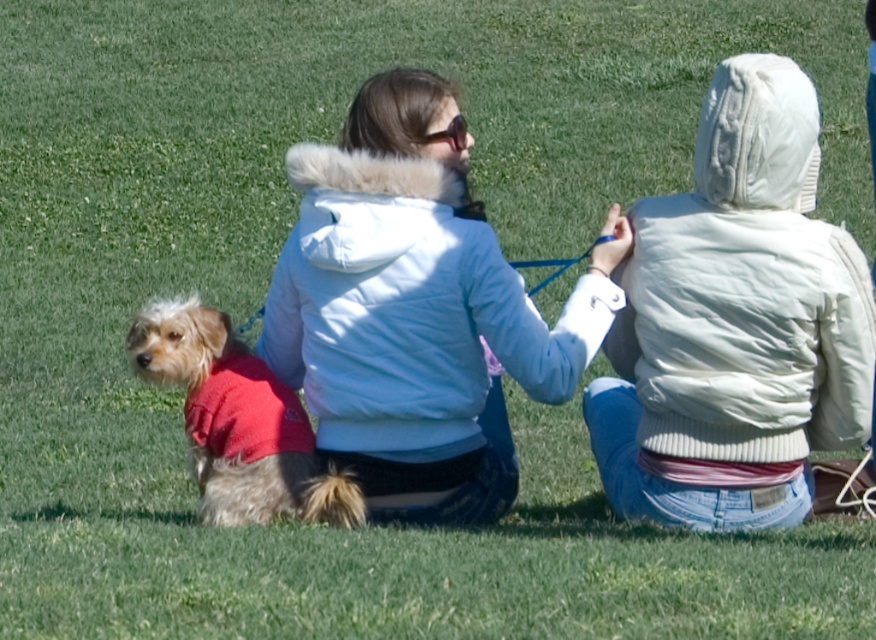
Question: Which point is closer to the camera?

Choices:
 (A) (239, 492)
 (B) (281, 280)
 (C) (454, 129)
 (D) (782, 483)

Answer: (D)

Question: Estimate the real-world distances between objects in this image. Which object is farther from the white fuzzy jacket at upper right?

Choices:
 (A) fuzzy red sweater at lower left
 (B) clear plastic goggles at center

Answer: (A)

Question: Can you confirm if fuzzy red sweater at lower left is positioned to the left of clear plastic goggles at center?

Choices:
 (A) no
 (B) yes

Answer: (B)

Question: Does light blue puffy jacket at center come in front of clear plastic goggles at center?

Choices:
 (A) yes
 (B) no

Answer: (A)

Question: Is light blue puffy jacket at center further to the viewer compared to fuzzy red sweater at lower left?

Choices:
 (A) yes
 (B) no

Answer: (B)

Question: Which point appears closest to the camera in this image?

Choices:
 (A) (643, 378)
 (B) (126, 342)
 (C) (380, 240)
 (D) (438, 132)

Answer: (C)